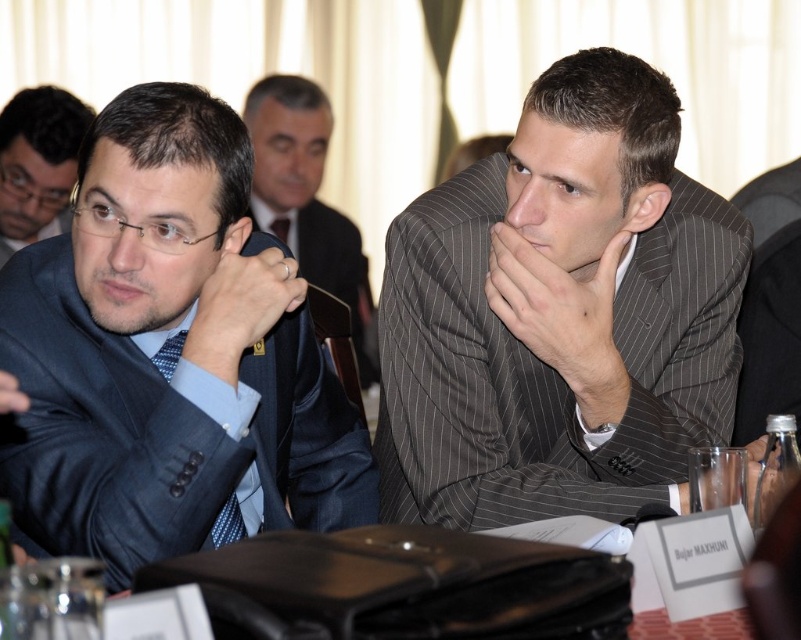
You are a photographer standing behind the table where the gray pinstripe suit at center and the matte blue suit at left are seated. You want to capture a photo that includes both individuals without any overlap. Given the distance between them, what is the minimum width of the camera lens field of view required to achieve this?

The minimum width of the camera lens field of view required to capture both the gray pinstripe suit at center and the matte blue suit at left without overlap is 46.68 centimeters, as that is the distance between them.

You are standing in the conference room and want to hand a document to the gray pinstripe suit at center. Can you reach them without moving from your current position if your arm can extend 1.2 meters?

The gray pinstripe suit at center is 1.43 meters away from you, which is beyond the reach of your 1.2 meter arm extension. You will need to move closer to hand them the document.

You are standing in front of the conference table and need to place a small object on the table. The two points you are considering are point (504, 300) and point (47, 176). Which point is closer to you?

Point (504, 300) is closer to the viewer than point (47, 176).